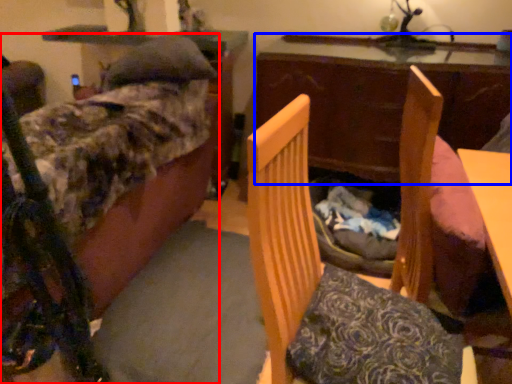
Question: Which point is further to the camera, furniture (highlighted by a red box) or table (highlighted by a blue box)?

Choices:
 (A) furniture
 (B) table

Answer: (B)